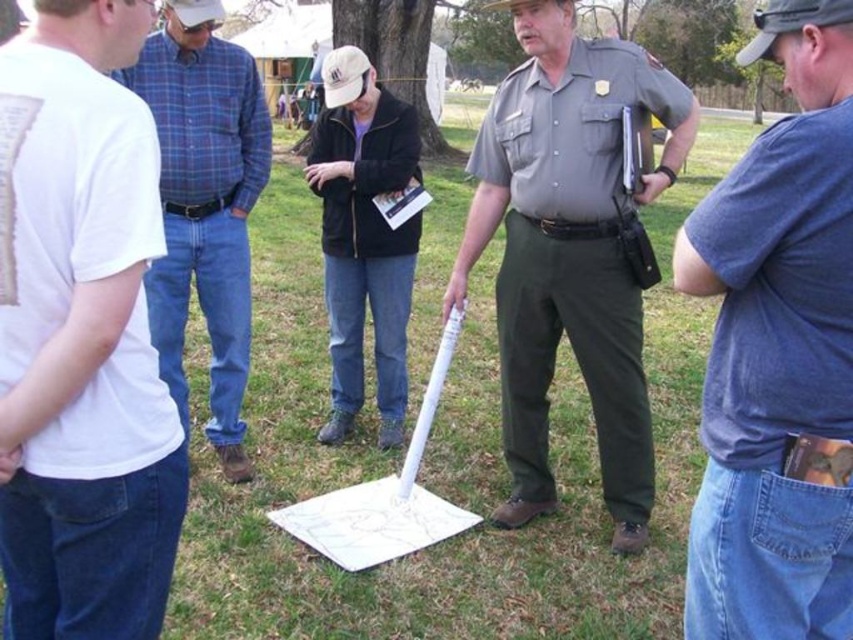
Is gray uniformed officer at center thinner than blue plaid shirt at left?

Incorrect, gray uniformed officer at center's width is not less than blue plaid shirt at left's.

The height and width of the screenshot is (640, 853). What do you see at coordinates (569, 250) in the screenshot?
I see `gray uniformed officer at center` at bounding box center [569, 250].

This screenshot has height=640, width=853. I want to click on gray uniformed officer at center, so click(x=569, y=250).

The image size is (853, 640). What are the coordinates of `gray uniformed officer at center` in the screenshot? It's located at (569, 250).

Describe the element at coordinates (84, 342) in the screenshot. I see `white t-shirt at left` at that location.

Between white t-shirt at left and blue plaid shirt at left, which one is positioned lower?

Positioned lower is white t-shirt at left.

Which is in front, point (80, 115) or point (248, 477)?

Point (80, 115) is more forward.

Find the location of a particular element. The width and height of the screenshot is (853, 640). white t-shirt at left is located at coordinates (84, 342).

Which of these two, blue denim jeans at lower right or black matte jacket at center, stands shorter?

Standing shorter between the two is blue denim jeans at lower right.

Is point (780, 262) positioned before point (357, 308)?

Yes, point (780, 262) is closer to viewer.

Locate an element on the screen. Image resolution: width=853 pixels, height=640 pixels. blue denim jeans at lower right is located at coordinates (776, 352).